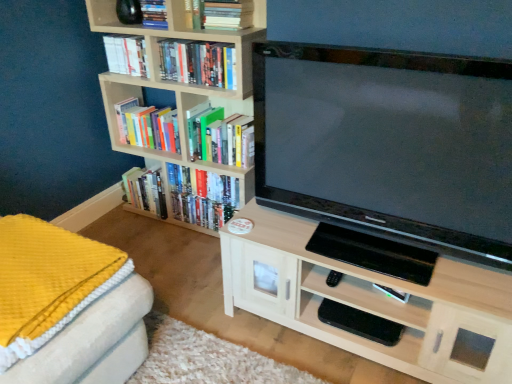
Where is `vacant space situated above light wood cabinet at center, the first shelf positioned from the bottom (from a real-world perspective)`? vacant space situated above light wood cabinet at center, the first shelf positioned from the bottom (from a real-world perspective) is located at coordinates (376, 253).